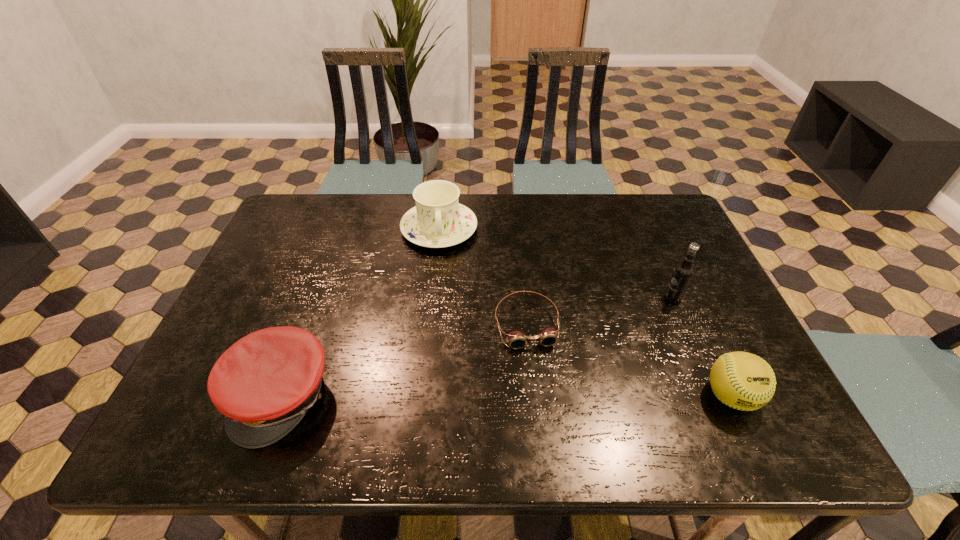
Locate an element on the screen. The image size is (960, 540). softball that is at the right edge is located at coordinates pyautogui.click(x=741, y=380).

Find the location of a particular element. root beer located at the right edge is located at coordinates (683, 272).

Locate an element on the screen. This screenshot has height=540, width=960. object situated at the near left corner is located at coordinates (264, 384).

Where is `object at the near right corner`? This screenshot has width=960, height=540. object at the near right corner is located at coordinates (741, 380).

The width and height of the screenshot is (960, 540). In the image, there is a desktop. Find the location of `vacant space at the far edge`. vacant space at the far edge is located at coordinates pos(601,227).

Identify the location of vacant area at the near edge of the desktop. (639, 380).

Identify the location of free spot at the right edge of the desktop. (641, 240).

Locate an element on the screen. blank space at the far left corner of the desktop is located at coordinates (313, 224).

Locate an element on the screen. The height and width of the screenshot is (540, 960). free point at the near left corner is located at coordinates (186, 401).

You are a GUI agent. You are given a task and a screenshot of the screen. Output one action in this format:
    pyautogui.click(x=<x>, y=<y>)
    Task: Click on the free space at the far right corner of the desktop
    Image resolution: width=960 pixels, height=540 pixels.
    Given the screenshot: What is the action you would take?
    pyautogui.click(x=663, y=222)